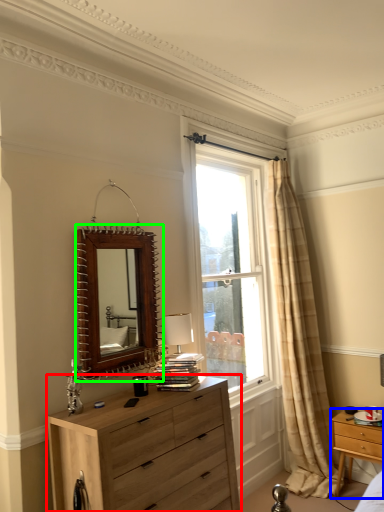
Question: Estimate the real-world distances between objects in this image. Which object is closer to chest of drawers (highlighted by a red box), nightstand (highlighted by a blue box) or mirror (highlighted by a green box)?

Choices:
 (A) nightstand
 (B) mirror

Answer: (B)